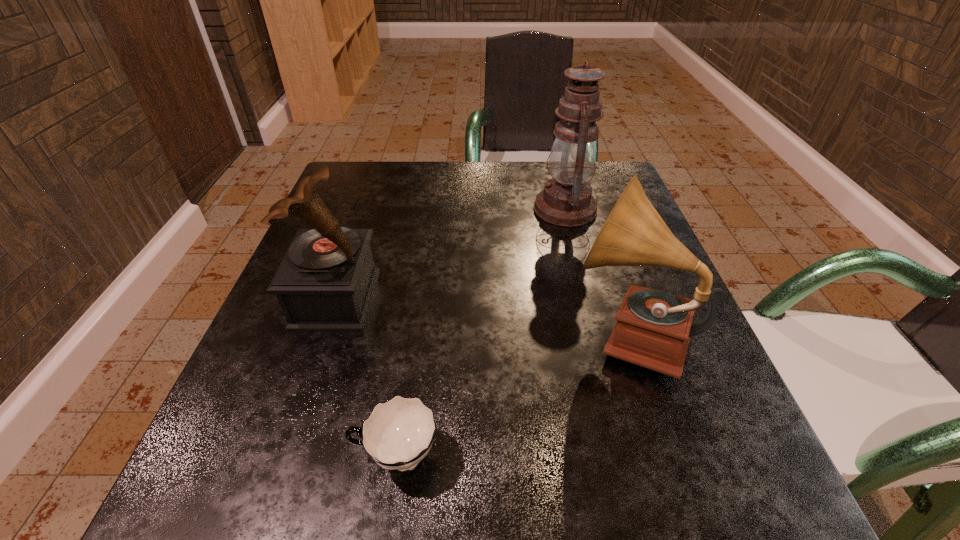
Locate an element on the screen. the tallest object is located at coordinates (566, 201).

Find the location of a particular element. The width and height of the screenshot is (960, 540). oil lamp is located at coordinates (566, 201).

The width and height of the screenshot is (960, 540). Find the location of `the right phonograph_record`. the right phonograph_record is located at coordinates (653, 329).

Where is `the leftmost object`? This screenshot has width=960, height=540. the leftmost object is located at coordinates (325, 282).

Where is `the nearest object`? the nearest object is located at coordinates (398, 434).

The height and width of the screenshot is (540, 960). In order to click on the second object from left to right in this screenshot , I will do `click(398, 434)`.

Where is `free space located on the front of the farthest object`? This screenshot has height=540, width=960. free space located on the front of the farthest object is located at coordinates (614, 400).

Identify the location of blank space located on the horn of the right phonograph_record. The image size is (960, 540). (437, 333).

At what (x,y) coordinates should I click in order to perform the action: click on vacant space located on the horn of the right phonograph_record. Please return your answer as a coordinate pair (x, y). The height and width of the screenshot is (540, 960). Looking at the image, I should click on (536, 333).

You are a GUI agent. You are given a task and a screenshot of the screen. Output one action in this format:
    pyautogui.click(x=<x>, y=<y>)
    Task: Click on the free point located on the horn of the right phonograph_record
    
    Given the screenshot: What is the action you would take?
    pyautogui.click(x=405, y=333)